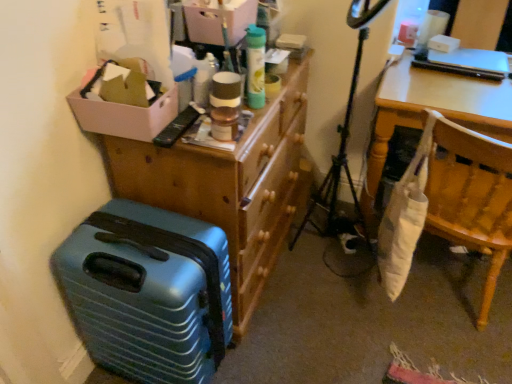
Identify the location of wooden dresser at upper center. (229, 185).

Describe the element at coordinates (433, 109) in the screenshot. Image resolution: width=512 pixels, height=384 pixels. I see `white fabric bag at right` at that location.

Identify the location of matte cardboard box at upper center. (203, 21).

Is teal matte suitcase at lower left spatially inside matte cardboard box at upper center, or outside of it?

teal matte suitcase at lower left exists outside the volume of matte cardboard box at upper center.

From the image's perspective, who appears lower, teal matte suitcase at lower left or matte cardboard box at upper center?

teal matte suitcase at lower left is shown below in the image.

Which object is positioned more to the right, teal matte suitcase at lower left or matte cardboard box at upper center?

Positioned to the right is matte cardboard box at upper center.

In terms of height, does teal matte suitcase at lower left look taller or shorter compared to matte cardboard box at upper center?

teal matte suitcase at lower left is taller than matte cardboard box at upper center.

Is wooden dresser at upper center wider or thinner than teal matte suitcase at lower left?

Considering their sizes, wooden dresser at upper center looks broader than teal matte suitcase at lower left.

Is teal matte suitcase at lower left completely or partially inside wooden dresser at upper center?

No, teal matte suitcase at lower left is not a part of wooden dresser at upper center.

Considering the relative sizes of wooden dresser at upper center and teal matte suitcase at lower left in the image provided, is wooden dresser at upper center taller than teal matte suitcase at lower left?

Indeed, wooden dresser at upper center has a greater height compared to teal matte suitcase at lower left.

Identify the location of dresser behind the teal matte suitcase at lower left. This screenshot has width=512, height=384. (229, 185).

Can you tell me how much wooden dresser at upper center and white fabric bag at right differ in facing direction?

wooden dresser at upper center and white fabric bag at right are facing 91.4 degrees away from each other.

Considering the relative sizes of wooden dresser at upper center and white fabric bag at right in the image provided, is wooden dresser at upper center bigger than white fabric bag at right?

No, wooden dresser at upper center is not bigger than white fabric bag at right.

Measure the distance between wooden dresser at upper center and white fabric bag at right.

They are 24.29 inches apart.

Is wooden dresser at upper center inside or outside of white fabric bag at right?

wooden dresser at upper center cannot be found inside white fabric bag at right.

Is point (167, 274) less distant than point (381, 90)?

Yes, it is in front of point (381, 90).

In terms of width, does teal matte suitcase at lower left look wider or thinner when compared to white fabric bag at right?

Considering their sizes, teal matte suitcase at lower left looks slimmer than white fabric bag at right.

Is teal matte suitcase at lower left oriented towards white fabric bag at right?

No.

Is point (111, 121) closer or farther from the camera than point (123, 254)?

Point (111, 121) is positioned farther from the camera compared to point (123, 254).

Is teal matte suitcase at lower left at the back of white cardboard box at upper left?

No, white cardboard box at upper left is not facing away from teal matte suitcase at lower left.

From the image's perspective, is white cardboard box at upper left over teal matte suitcase at lower left?

Indeed, from the image's perspective, white cardboard box at upper left is shown above teal matte suitcase at lower left.

Is white cardboard box at upper left touching teal matte suitcase at lower left?

No, white cardboard box at upper left is not with teal matte suitcase at lower left.

From their relative heights in the image, would you say matte cardboard box at upper center is taller or shorter than wooden dresser at upper center?

In the image, matte cardboard box at upper center appears to be shorter than wooden dresser at upper center.

Are matte cardboard box at upper center and wooden dresser at upper center beside each other?

No.

At what (x,y) coordinates should I click in order to perform the action: click on dresser below the matte cardboard box at upper center (from the image's perspective). Please return your answer as a coordinate pair (x, y). Looking at the image, I should click on (229, 185).

Is the position of white fabric bag at right less distant than that of teal matte suitcase at lower left?

No, it is behind teal matte suitcase at lower left.

Which is more to the left, white fabric bag at right or teal matte suitcase at lower left?

Positioned to the left is teal matte suitcase at lower left.

Looking at this image, which of these two, white fabric bag at right or teal matte suitcase at lower left, stands taller?

white fabric bag at right is taller.

Identify the location of desk that is above the teal matte suitcase at lower left (from the image's perspective). (433, 109).

The height and width of the screenshot is (384, 512). In order to click on storage box above the teal matte suitcase at lower left (from a real-world perspective) in this screenshot , I will do `click(203, 21)`.

Locate an element on the screen. suitcase on the left of wooden dresser at upper center is located at coordinates (148, 292).

From the image, which object appears to be nearer to white cardboard box at upper left, white fabric bag at right or wooden dresser at upper center?

Based on the image, wooden dresser at upper center appears to be nearer to white cardboard box at upper left.

Based on their spatial positions, is wooden dresser at upper center or white cardboard box at upper left closer to white fabric bag at right?

Among the two, wooden dresser at upper center is located nearer to white fabric bag at right.

Considering their positions, is wooden dresser at upper center positioned closer to white cardboard box at upper left than teal matte suitcase at lower left?

The object closer to white cardboard box at upper left is wooden dresser at upper center.

Estimate the real-world distances between objects in this image. Which object is closer to white fabric bag at right, wooden dresser at upper center or teal matte suitcase at lower left?

wooden dresser at upper center.

When comparing their distances from matte cardboard box at upper center, does white fabric bag at right or teal matte suitcase at lower left seem closer?

Among the two, teal matte suitcase at lower left is located nearer to matte cardboard box at upper center.

When comparing their distances from white fabric bag at right, does white cardboard box at upper left or teal matte suitcase at lower left seem further?

teal matte suitcase at lower left lies further to white fabric bag at right than the other object.

Looking at the image, which one is located closer to wooden dresser at upper center, teal matte suitcase at lower left or matte cardboard box at upper center?

teal matte suitcase at lower left is positioned closer to the anchor wooden dresser at upper center.

Looking at this image, based on their spatial positions, is white fabric bag at right or white cardboard box at upper left closer to wooden dresser at upper center?

Based on the image, white cardboard box at upper left appears to be nearer to wooden dresser at upper center.

Identify the location of box between matte cardboard box at upper center and teal matte suitcase at lower left in the vertical direction. The image size is (512, 384). (124, 116).

Where is `storage box situated between white cardboard box at upper left and white fabric bag at right from left to right`? The height and width of the screenshot is (384, 512). storage box situated between white cardboard box at upper left and white fabric bag at right from left to right is located at coordinates (203, 21).

This screenshot has height=384, width=512. Identify the location of dresser between teal matte suitcase at lower left and white fabric bag at right from left to right. (229, 185).

At what (x,y) coordinates should I click in order to perform the action: click on storage box situated between teal matte suitcase at lower left and white fabric bag at right from left to right. Please return your answer as a coordinate pair (x, y). This screenshot has height=384, width=512. Looking at the image, I should click on (203, 21).